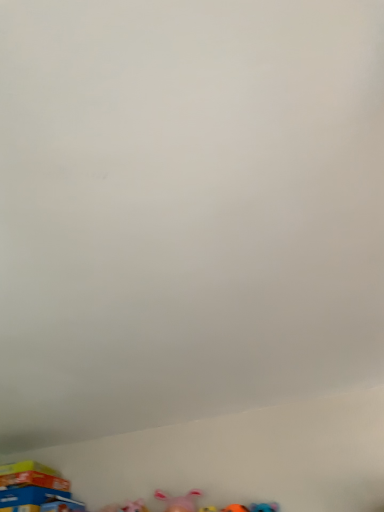
Identify the location of pink fabric toy at lower center, the 1th toy in the right-to-left sequence. (179, 501).

Describe the element at coordinates (179, 501) in the screenshot. I see `pink fabric toy at lower center, which is counted as the 2th toy, starting from the back` at that location.

At what (x,y) coordinates should I click in order to perform the action: click on blue cardboard box at lower left, positioned as the second toy in front-to-back order. Please return your answer as a coordinate pair (x, y). The height and width of the screenshot is (512, 384). Looking at the image, I should click on (30, 486).

This screenshot has width=384, height=512. What do you see at coordinates (30, 486) in the screenshot? I see `blue cardboard box at lower left, positioned as the second toy in front-to-back order` at bounding box center [30, 486].

Find the location of a particular element. pink fabric toy at lower center, the 1th toy from the front is located at coordinates (179, 501).

Can you confirm if blue cardboard box at lower left, positioned as the second toy in front-to-back order, is positioned to the right of pink fabric toy at lower center, the 1th toy in the right-to-left sequence?

No.

Considering the relative positions of blue cardboard box at lower left, which appears as the 1th toy when viewed from the back, and pink fabric toy at lower center, which is counted as the 2th toy, starting from the back, in the image provided, is blue cardboard box at lower left, which appears as the 1th toy when viewed from the back, in front of pink fabric toy at lower center, which is counted as the 2th toy, starting from the back,?

That is False.

Which is behind, point (54, 481) or point (160, 495)?

Point (54, 481)

From the image's perspective, is blue cardboard box at lower left, the 1th toy in the left-to-right sequence, under pink fabric toy at lower center, the 1th toy from the front?

Correct, blue cardboard box at lower left, the 1th toy in the left-to-right sequence, appears lower than pink fabric toy at lower center, the 1th toy from the front, in the image.

From the picture: From a real-world perspective, is blue cardboard box at lower left, which appears as the 1th toy when viewed from the back, positioned above or below pink fabric toy at lower center, the 1th toy from the front?

From a real-world perspective, blue cardboard box at lower left, which appears as the 1th toy when viewed from the back, is physically above pink fabric toy at lower center, the 1th toy from the front.

Can you confirm if blue cardboard box at lower left, positioned as the second toy in front-to-back order, is wider than pink fabric toy at lower center, the second toy viewed from the left?

Yes.

Is blue cardboard box at lower left, the 1th toy in the left-to-right sequence, taller or shorter than pink fabric toy at lower center, the 1th toy from the front?

In the image, blue cardboard box at lower left, the 1th toy in the left-to-right sequence, appears to be taller than pink fabric toy at lower center, the 1th toy from the front.

Considering the relative sizes of blue cardboard box at lower left, the 1th toy in the left-to-right sequence, and pink fabric toy at lower center, which is counted as the 2th toy, starting from the back, in the image provided, is blue cardboard box at lower left, the 1th toy in the left-to-right sequence, smaller than pink fabric toy at lower center, which is counted as the 2th toy, starting from the back,?

No.

Looking at this image, is blue cardboard box at lower left, which ranks as the 2th toy in right-to-left order, outside of pink fabric toy at lower center, the 1th toy from the front?

Yes, blue cardboard box at lower left, which ranks as the 2th toy in right-to-left order, is located beyond the bounds of pink fabric toy at lower center, the 1th toy from the front.

Is blue cardboard box at lower left, the 1th toy in the left-to-right sequence, far from pink fabric toy at lower center, the 1th toy in the right-to-left sequence?

blue cardboard box at lower left, the 1th toy in the left-to-right sequence, is actually quite close to pink fabric toy at lower center, the 1th toy in the right-to-left sequence.

Is blue cardboard box at lower left, positioned as the second toy in front-to-back order, positioned with its back to pink fabric toy at lower center, the 1th toy from the front?

No, blue cardboard box at lower left, positioned as the second toy in front-to-back order,'s orientation is not away from pink fabric toy at lower center, the 1th toy from the front.

How different are the orientations of blue cardboard box at lower left, which ranks as the 2th toy in right-to-left order, and pink fabric toy at lower center, the 1th toy from the front, in degrees?

The angle between the facing direction of blue cardboard box at lower left, which ranks as the 2th toy in right-to-left order, and the facing direction of pink fabric toy at lower center, the 1th toy from the front, is 0.000542 degrees.

How much distance is there between blue cardboard box at lower left, which ranks as the 2th toy in right-to-left order, and pink fabric toy at lower center, the 1th toy in the right-to-left sequence?

blue cardboard box at lower left, which ranks as the 2th toy in right-to-left order, and pink fabric toy at lower center, the 1th toy in the right-to-left sequence, are 20.44 inches apart.

You are a GUI agent. You are given a task and a screenshot of the screen. Output one action in this format:
    pyautogui.click(x=<x>, y=<y>)
    Task: Click on the toy located below the pink fabric toy at lower center, the 1th toy in the right-to-left sequence (from the image's perspective)
    The image size is (384, 512).
    Given the screenshot: What is the action you would take?
    tap(30, 486)

Does pink fabric toy at lower center, the 1th toy from the front, appear on the right side of blue cardboard box at lower left, which ranks as the 2th toy in right-to-left order?

Yes, pink fabric toy at lower center, the 1th toy from the front, is to the right of blue cardboard box at lower left, which ranks as the 2th toy in right-to-left order.

Is pink fabric toy at lower center, the 1th toy from the front, behind blue cardboard box at lower left, which appears as the 1th toy when viewed from the back?

No, it is in front of blue cardboard box at lower left, which appears as the 1th toy when viewed from the back.

Is point (191, 490) farther from camera compared to point (30, 479)?

No, (191, 490) is closer to viewer.

From the image's perspective, is pink fabric toy at lower center, the 1th toy in the right-to-left sequence, located above blue cardboard box at lower left, the 1th toy in the left-to-right sequence?

Yes, from the image's perspective, pink fabric toy at lower center, the 1th toy in the right-to-left sequence, is on top of blue cardboard box at lower left, the 1th toy in the left-to-right sequence.

From a real-world perspective, who is located lower, pink fabric toy at lower center, the 1th toy in the right-to-left sequence, or blue cardboard box at lower left, which appears as the 1th toy when viewed from the back?

pink fabric toy at lower center, the 1th toy in the right-to-left sequence, from a real-world perspective.

Is pink fabric toy at lower center, the 1th toy from the front, wider than blue cardboard box at lower left, which appears as the 1th toy when viewed from the back?

No, pink fabric toy at lower center, the 1th toy from the front, is not wider than blue cardboard box at lower left, which appears as the 1th toy when viewed from the back.

Considering the relative sizes of pink fabric toy at lower center, which is counted as the 2th toy, starting from the back, and blue cardboard box at lower left, the 1th toy in the left-to-right sequence, in the image provided, is pink fabric toy at lower center, which is counted as the 2th toy, starting from the back, taller than blue cardboard box at lower left, the 1th toy in the left-to-right sequence,?

No, pink fabric toy at lower center, which is counted as the 2th toy, starting from the back, is not taller than blue cardboard box at lower left, the 1th toy in the left-to-right sequence.

Is pink fabric toy at lower center, the 1th toy in the right-to-left sequence, bigger or smaller than blue cardboard box at lower left, the 1th toy in the left-to-right sequence?

Considering their sizes, pink fabric toy at lower center, the 1th toy in the right-to-left sequence, takes up less space than blue cardboard box at lower left, the 1th toy in the left-to-right sequence.

Is pink fabric toy at lower center, the second toy viewed from the left, spatially inside blue cardboard box at lower left, which ranks as the 2th toy in right-to-left order, or outside of it?

pink fabric toy at lower center, the second toy viewed from the left, is outside blue cardboard box at lower left, which ranks as the 2th toy in right-to-left order.

Is pink fabric toy at lower center, the second toy viewed from the left, not near blue cardboard box at lower left, which ranks as the 2th toy in right-to-left order?

They are positioned close to each other.

Is pink fabric toy at lower center, the second toy viewed from the left, facing away from blue cardboard box at lower left, which appears as the 1th toy when viewed from the back?

That's not correct — pink fabric toy at lower center, the second toy viewed from the left, is not looking away from blue cardboard box at lower left, which appears as the 1th toy when viewed from the back.

You are a GUI agent. You are given a task and a screenshot of the screen. Output one action in this format:
    pyautogui.click(x=<x>, y=<y>)
    Task: Click on the toy lying on the left of pink fabric toy at lower center, the 1th toy in the right-to-left sequence
    
    Given the screenshot: What is the action you would take?
    pyautogui.click(x=30, y=486)

This screenshot has height=512, width=384. I want to click on toy that appears behind the pink fabric toy at lower center, which is counted as the 2th toy, starting from the back, so click(x=30, y=486).

Where is `toy on the left of the pink fabric toy at lower center, which is counted as the 2th toy, starting from the back`? Image resolution: width=384 pixels, height=512 pixels. toy on the left of the pink fabric toy at lower center, which is counted as the 2th toy, starting from the back is located at coordinates (30, 486).